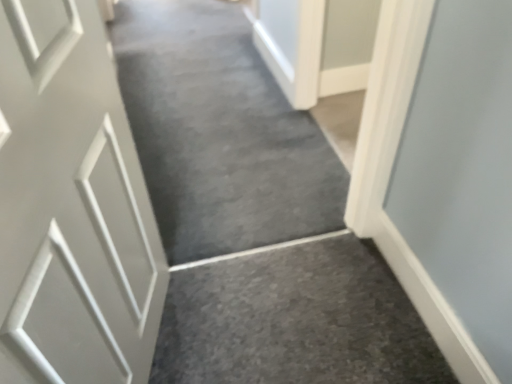
What do you see at coordinates (219, 133) in the screenshot?
I see `gray carpet at center` at bounding box center [219, 133].

Where is `gray carpet at center`? gray carpet at center is located at coordinates (219, 133).

Image resolution: width=512 pixels, height=384 pixels. Describe the element at coordinates (71, 206) in the screenshot. I see `white matte door at left` at that location.

At what (x,y) coordinates should I click in order to perform the action: click on white matte door at left. Please return your answer as a coordinate pair (x, y). This screenshot has height=384, width=512. Looking at the image, I should click on (71, 206).

Locate an element on the screen. gray carpet at center is located at coordinates (219, 133).

Between gray carpet at center and white matte door at left, which one appears on the left side from the viewer's perspective?

gray carpet at center.

Is the depth of gray carpet at center less than that of white matte door at left?

No, it is not.

Does point (238, 126) come closer to viewer compared to point (120, 247)?

That is False.

From the image's perspective, is gray carpet at center located above white matte door at left?

Yes, from the image's perspective, gray carpet at center is on top of white matte door at left.

From a real-world perspective, is gray carpet at center positioned over white matte door at left based on gravity?

No, from a real-world perspective, gray carpet at center is not on top of white matte door at left.

Considering the sizes of objects gray carpet at center and white matte door at left in the image provided, who is wider, gray carpet at center or white matte door at left?

Wider between the two is gray carpet at center.

Considering the relative sizes of gray carpet at center and white matte door at left in the image provided, is gray carpet at center shorter than white matte door at left?

Indeed, gray carpet at center has a lesser height compared to white matte door at left.

In terms of size, does gray carpet at center appear bigger or smaller than white matte door at left?

In the image, gray carpet at center appears to be larger than white matte door at left.

Is white matte door at left completely or partially inside gray carpet at center?

No, gray carpet at center does not contain white matte door at left.

Is there a large distance between gray carpet at center and white matte door at left?

They are positioned close to each other.

Looking at this image, could you tell me if gray carpet at center is facing white matte door at left?

No, gray carpet at center is not aimed at white matte door at left.

What's the angular difference between gray carpet at center and white matte door at left's facing directions?

The angle between the facing direction of gray carpet at center and the facing direction of white matte door at left is 106 degrees.

In the image, there is a white matte door at left. Identify the location of aisle above it (from the image's perspective). This screenshot has width=512, height=384. (219, 133).

Is white matte door at left at the right side of gray carpet at center?

Yes.

Considering the relative positions of white matte door at left and gray carpet at center in the image provided, is white matte door at left in front of gray carpet at center?

Yes, it is.

Does point (7, 124) lie in front of point (306, 139)?

Yes, it is in front of point (306, 139).

From the image's perspective, which is below, white matte door at left or gray carpet at center?

white matte door at left appears lower in the image.

From a real-world perspective, is white matte door at left physically below gray carpet at center?

No, from a real-world perspective, white matte door at left is not beneath gray carpet at center.

Can you confirm if white matte door at left is thinner than gray carpet at center?

Yes.

Considering the sizes of objects white matte door at left and gray carpet at center in the image provided, who is shorter, white matte door at left or gray carpet at center?

gray carpet at center is shorter.

Can you confirm if white matte door at left is smaller than gray carpet at center?

Indeed, white matte door at left has a smaller size compared to gray carpet at center.

Is gray carpet at center a part of white matte door at left?

Definitely not — gray carpet at center is not inside white matte door at left.

Would you consider white matte door at left to be distant from gray carpet at center?

white matte door at left is actually quite close to gray carpet at center.

Could you tell me if white matte door at left is turned towards gray carpet at center?

No, white matte door at left is not turned towards gray carpet at center.

How distant is white matte door at left from gray carpet at center?

The distance of white matte door at left from gray carpet at center is 33.78 inches.

You are a GUI agent. You are given a task and a screenshot of the screen. Output one action in this format:
    pyautogui.click(x=<x>, y=<y>)
    Task: Click on the aisle below the white matte door at left (from a real-world perspective)
    The height and width of the screenshot is (384, 512).
    Given the screenshot: What is the action you would take?
    pyautogui.click(x=219, y=133)

Locate an element on the screen. The image size is (512, 384). door that appears on the right of gray carpet at center is located at coordinates (71, 206).

This screenshot has width=512, height=384. I want to click on door above the gray carpet at center (from a real-world perspective), so click(71, 206).